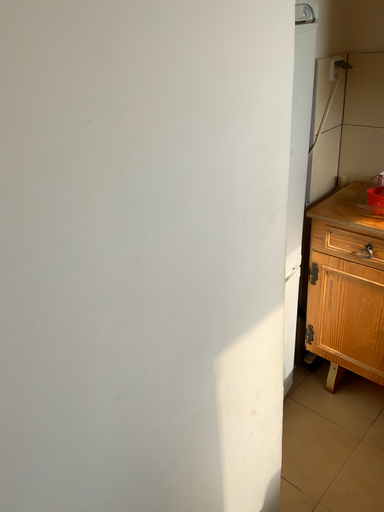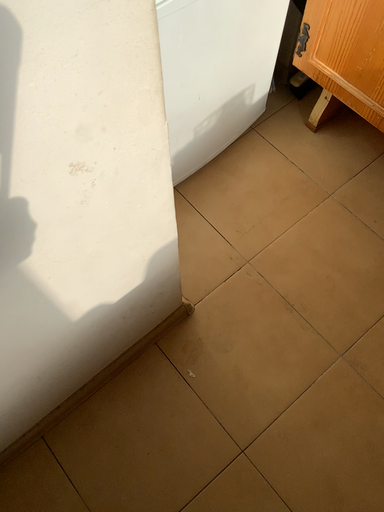
Question: How did the camera likely rotate when shooting the video?

Choices:
 (A) rotated downward
 (B) rotated upward

Answer: (A)